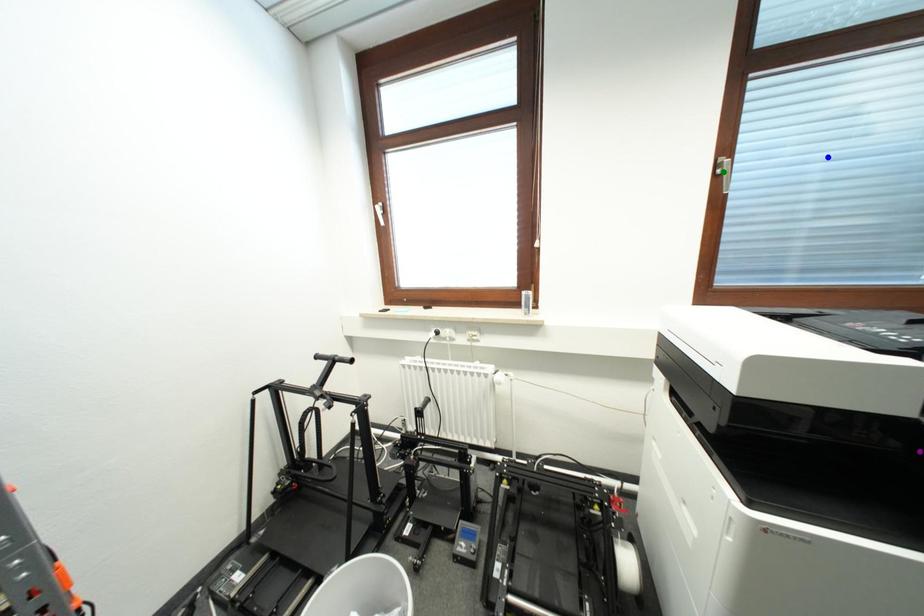
Order these from farthest to nearest:
green point
blue point
purple point

green point → blue point → purple point